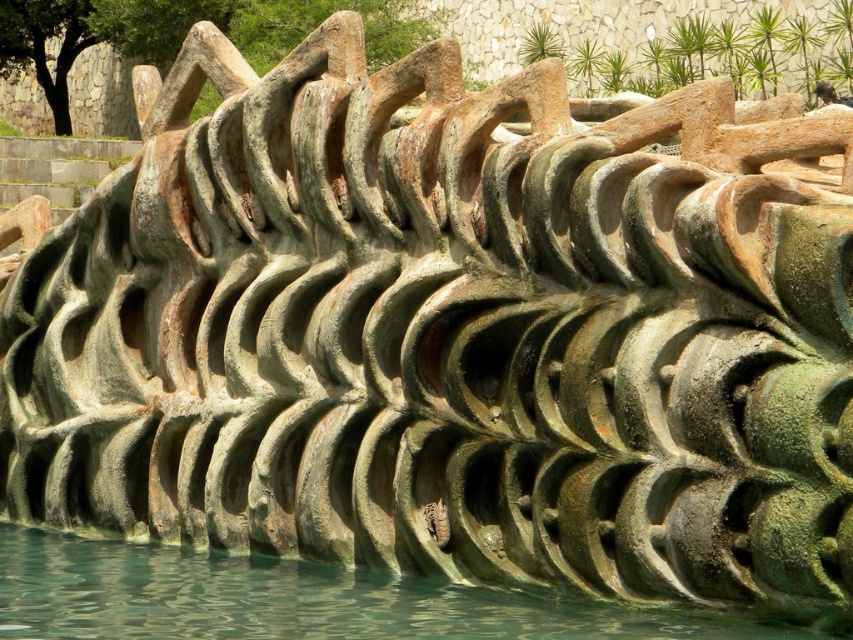
From the picture: Which is more to the right, greenish water at bottom or shiny metallic snake at center?

Positioned to the right is shiny metallic snake at center.

The image size is (853, 640). What are the coordinates of `greenish water at bottom` in the screenshot? It's located at (299, 600).

In order to click on greenish water at bottom in this screenshot , I will do `click(299, 600)`.